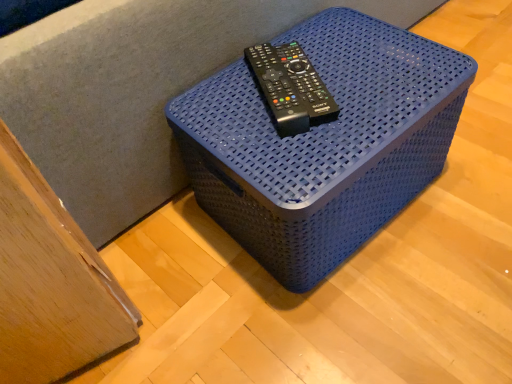
Where is `empty space that is ontop of blue woven basket at center (from a real-world perspective)`? Image resolution: width=512 pixels, height=384 pixels. empty space that is ontop of blue woven basket at center (from a real-world perspective) is located at coordinates (320, 83).